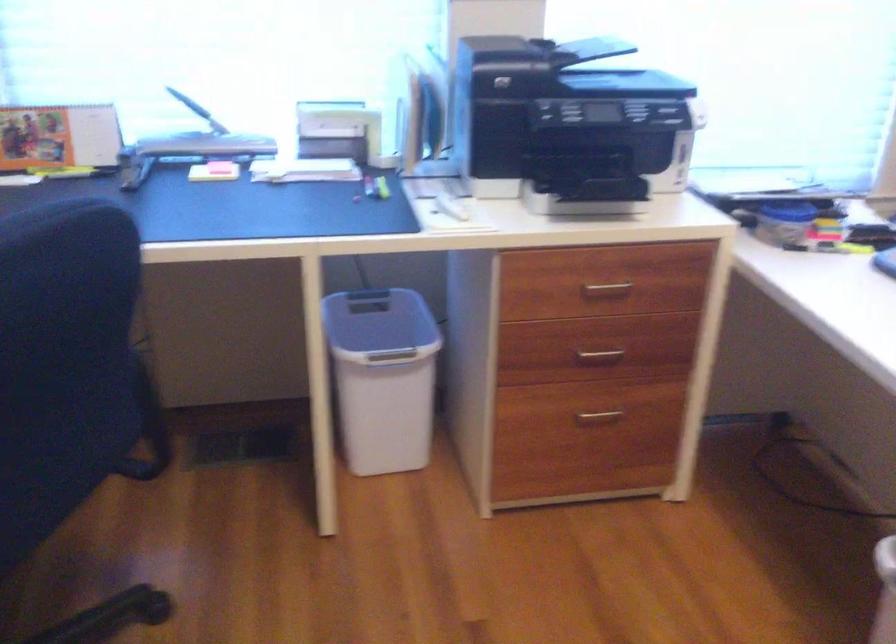
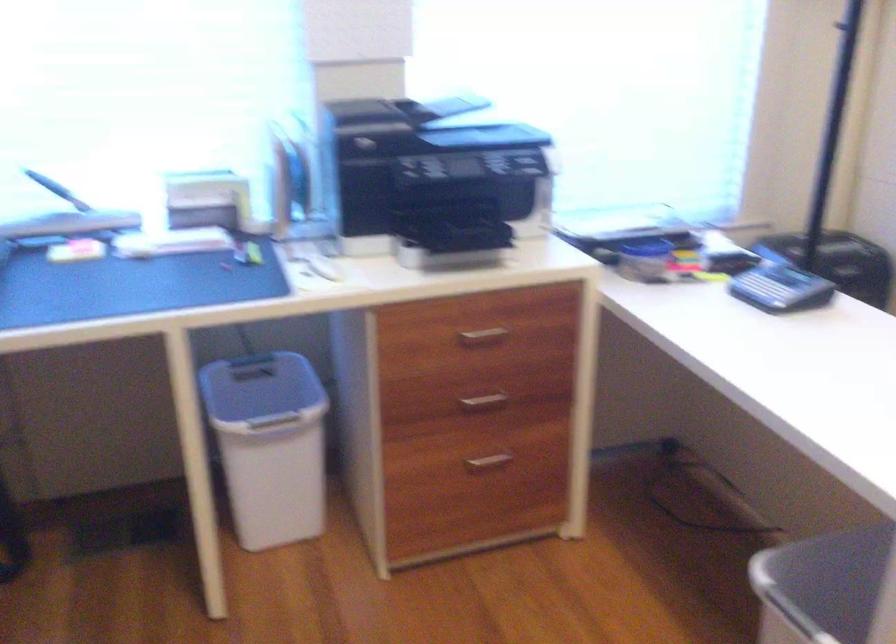
Where in the second image is the point corresponding to [606,286] from the first image?

(483, 334)